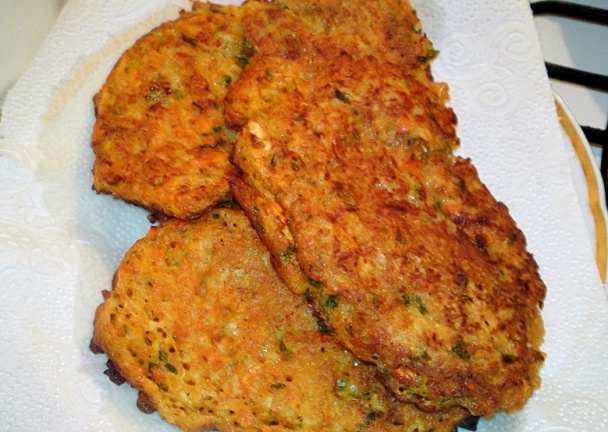
At what (x,y) coordinates should I click in order to perform the action: click on white paper towel. Please return your answer as a coordinate pair (x, y). This screenshot has width=608, height=432. Looking at the image, I should click on (47, 344).